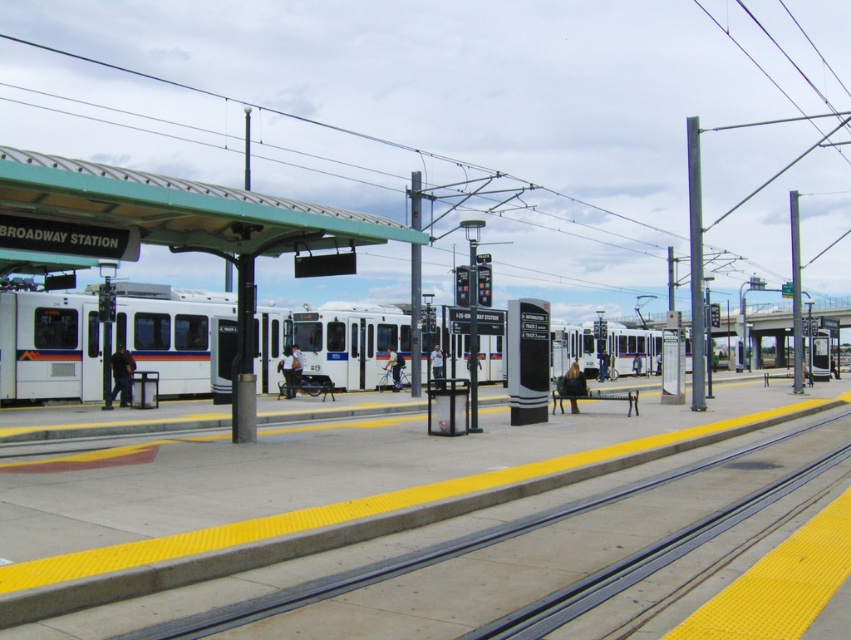
Can you confirm if dark blue uniform at left is wider than dark blue jeans at center?

Incorrect, dark blue uniform at left's width does not surpass dark blue jeans at center's.

Can you confirm if dark blue uniform at left is taller than dark blue jeans at center?

Incorrect, dark blue uniform at left's height is not larger of dark blue jeans at center's.

Measure the distance between point (129,364) and camera.

Point (129,364) is 24.86 meters away from camera.

Where is `dark blue uniform at left`? This screenshot has width=851, height=640. dark blue uniform at left is located at coordinates (121, 376).

Can you confirm if white matte train at left is positioned to the left of light blue shirt at center?

Incorrect, white matte train at left is not on the left side of light blue shirt at center.

Does point (347, 376) come closer to viewer compared to point (438, 369)?

Yes, it is in front of point (438, 369).

Does point (56, 301) come in front of point (432, 358)?

That is True.

The image size is (851, 640). What are the coordinates of `white matte train at left` in the screenshot? It's located at (49, 346).

Who is lower down, brown leather jacket at center or dark blue jeans at center?

dark blue jeans at center

Between brown leather jacket at center and dark blue jeans at center, which one appears on the right side from the viewer's perspective?

Positioned to the right is dark blue jeans at center.

Which is in front, point (563, 381) or point (600, 352)?

Point (563, 381)

Where is `brown leather jacket at center`? The image size is (851, 640). brown leather jacket at center is located at coordinates (574, 385).